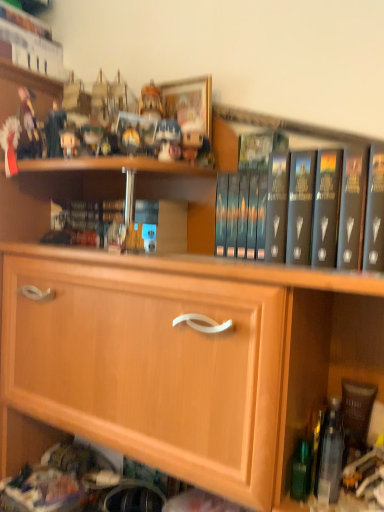
Identify the location of free space above dark gray hardcover book at center, the 1th book when ordered from front to back (from a real-world perspective). The width and height of the screenshot is (384, 512). (302, 147).